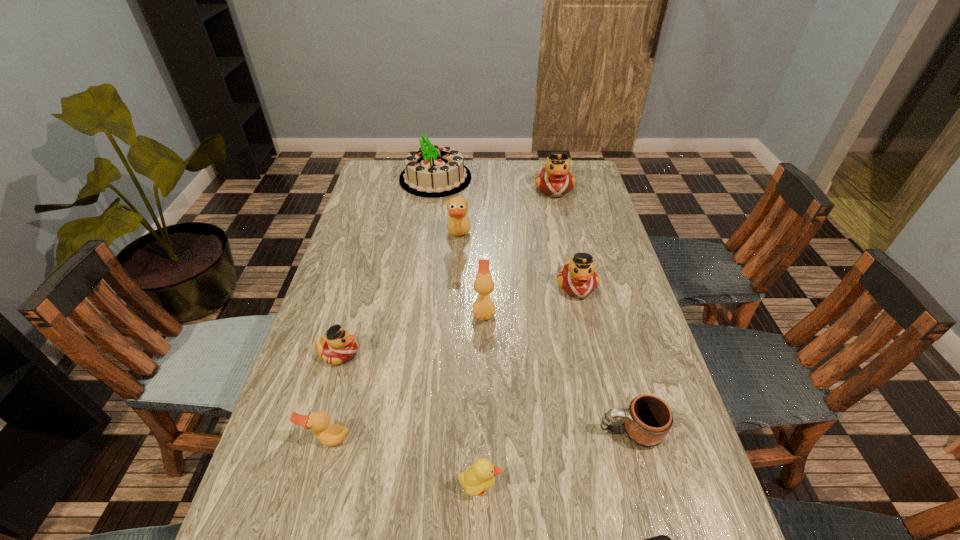
Where is `green birthday cake`? The image size is (960, 540). green birthday cake is located at coordinates (431, 171).

This screenshot has height=540, width=960. In order to click on the farthest duck in this screenshot , I will do `click(555, 180)`.

The height and width of the screenshot is (540, 960). In order to click on the biggest red duck in this screenshot , I will do `click(555, 180)`.

Locate an element on the screen. the biggest tan duck is located at coordinates click(458, 224).

Locate an element on the screen. Image resolution: width=960 pixels, height=540 pixels. the second tan duck from left to right is located at coordinates (458, 224).

Where is `the second farthest red duck`? the second farthest red duck is located at coordinates click(578, 278).

I want to click on the rightmost tan duck, so click(x=483, y=308).

The image size is (960, 540). What are the coordinates of `the fourth duck from left to right` in the screenshot? It's located at (483, 308).

This screenshot has height=540, width=960. Find the location of `the smallest red duck`. the smallest red duck is located at coordinates (338, 346).

The height and width of the screenshot is (540, 960). I want to click on the leftmost red duck, so click(x=338, y=346).